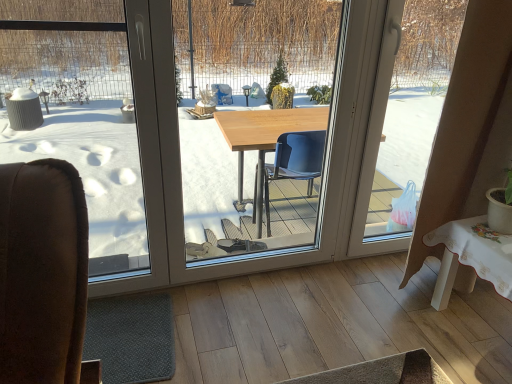
Question: From the image's perspective, is gray rubber mat at lower left located above transparent plastic bag at right, which is the first window screen in right-to-left order?

Choices:
 (A) yes
 (B) no

Answer: (B)

Question: Does gray rubber mat at lower left have a lesser width compared to transparent plastic bag at right, which is the first window screen in right-to-left order?

Choices:
 (A) yes
 (B) no

Answer: (B)

Question: Is gray rubber mat at lower left wider than transparent plastic bag at right, which is the first window screen in right-to-left order?

Choices:
 (A) yes
 (B) no

Answer: (A)

Question: Is gray rubber mat at lower left turned away from transparent plastic bag at right, which is the first window screen in right-to-left order?

Choices:
 (A) yes
 (B) no

Answer: (B)

Question: From a real-world perspective, is gray rubber mat at lower left below transparent plastic bag at right, the third window screen when ordered from left to right?

Choices:
 (A) no
 (B) yes

Answer: (B)

Question: Does gray rubber mat at lower left appear on the left side of transparent plastic bag at right, which is the first window screen in right-to-left order?

Choices:
 (A) no
 (B) yes

Answer: (B)

Question: Does wooden table at center, arranged as the 2th window screen when viewed from the right, have a larger size compared to transparent plastic bag at right, which is the first window screen in right-to-left order?

Choices:
 (A) yes
 (B) no

Answer: (B)

Question: Is wooden table at center, acting as the second window screen starting from the left, at the right side of transparent plastic bag at right, the third window screen when ordered from left to right?

Choices:
 (A) no
 (B) yes

Answer: (A)

Question: Is the depth of wooden table at center, arranged as the 2th window screen when viewed from the right, greater than that of transparent plastic bag at right, which is the first window screen in right-to-left order?

Choices:
 (A) no
 (B) yes

Answer: (A)

Question: Is wooden table at center, acting as the second window screen starting from the left, looking in the opposite direction of transparent plastic bag at right, the third window screen when ordered from left to right?

Choices:
 (A) no
 (B) yes

Answer: (A)

Question: Is wooden table at center, arranged as the 2th window screen when viewed from the right, at the left side of transparent plastic bag at right, which is the first window screen in right-to-left order?

Choices:
 (A) yes
 (B) no

Answer: (A)

Question: Is wooden table at center, arranged as the 2th window screen when viewed from the right, thinner than transparent plastic bag at right, which is the first window screen in right-to-left order?

Choices:
 (A) no
 (B) yes

Answer: (B)

Question: Considering the relative sizes of transparent glass window at left, the 1th window screen when ordered from left to right, and transparent plastic bag at right, which is the first window screen in right-to-left order, in the image provided, is transparent glass window at left, the 1th window screen when ordered from left to right, taller than transparent plastic bag at right, which is the first window screen in right-to-left order,?

Choices:
 (A) no
 (B) yes

Answer: (A)